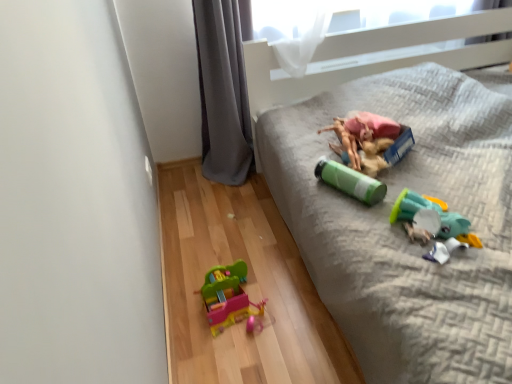
Locate an element on the screen. vacant space situated on the left part of gray fabric curtain at lower left is located at coordinates (186, 181).